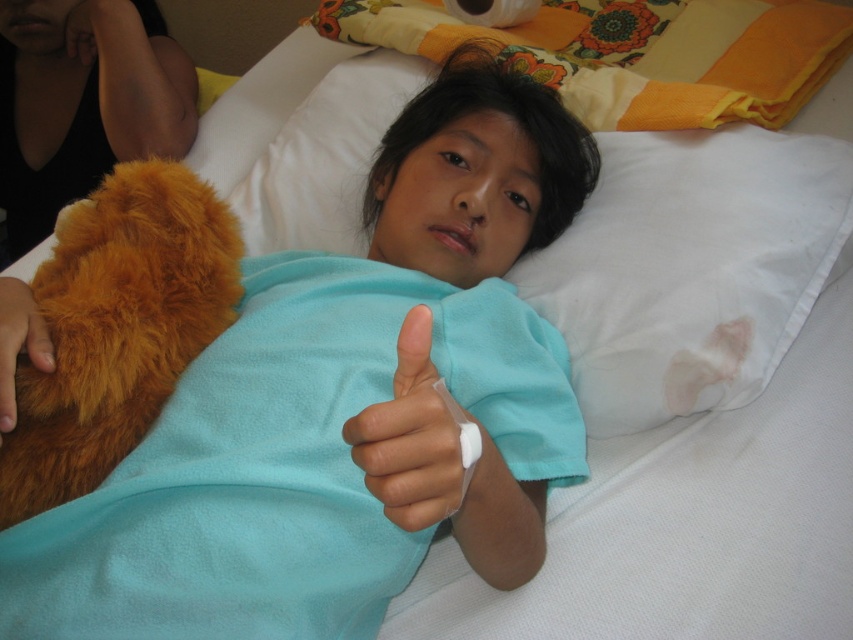
You are a nurse in a hospital room. You see two points marked in the scene. The first point is at coordinates point (x=80, y=300) and the second point is at point (x=407, y=403). Which point is closer to you?

Point (x=80, y=300) is closer to you because it is further to the camera than point (x=407, y=403).

You are a nurse checking the bed space for the child. The brown fuzzy stuffed animal at left and the brown furry hand at lower left are both on the bed. Which one takes up more horizontal space?

The brown fuzzy stuffed animal at left might be wider than brown furry hand at lower left, so it likely takes up more horizontal space.

You are a nurse in a hospital. You need to place a brown fuzzy stuffed animal at left on the bed so it is closer to the brown furry hand at lower left. Where should you move it from its current position?

The brown fuzzy stuffed animal at left is currently 25.43 inches away from the brown furry hand at lower left. To make it closer, move the brown fuzzy stuffed animal at left towards the brown furry hand at lower left to reduce the distance between them.